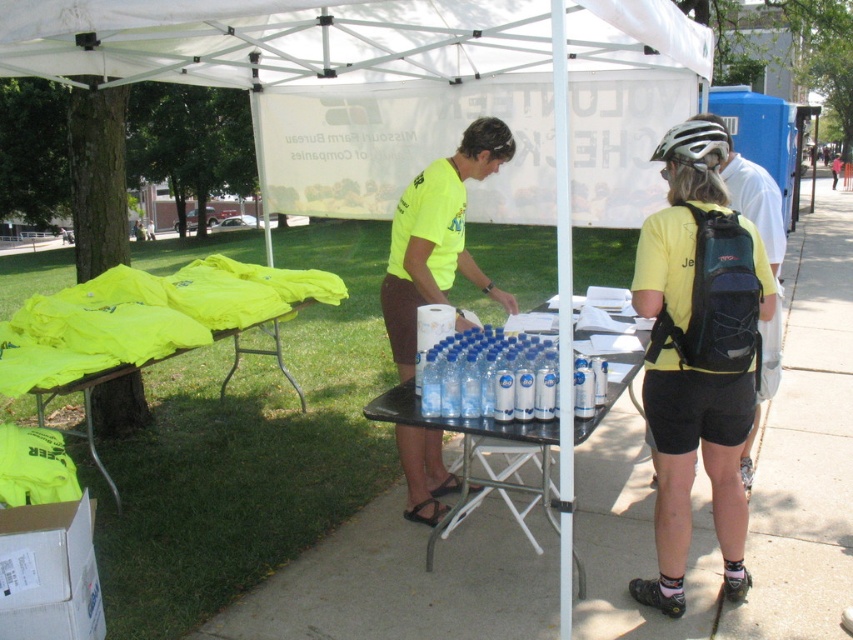
You are organizing an outdoor event and need to place a 6.5 feet long banner between the neon yellow fabric at left and the matte black backpack at right. Will there be enough space between them to fit the banner without bending it?

The distance between the neon yellow fabric at left and the matte black backpack at right is 8.25 feet. Since the banner is 6.5 feet long, there is sufficient space to place it straight between them without bending.

You are a runner participating in the Missouri Rail Trail Ultra Run and you are standing at the starting line, which is 10 feet away from the camera. You need to grab your race bib from the yellow matte shirt at center before the race starts. Can you reach it without moving closer?

The yellow matte shirt at center is 8.96 feet away from the camera. Since you are 10 feet away from the camera, you are 1.04 feet farther than the shirt, so you cannot reach it without moving closer.

In the scene shown: You are at an outdoor event and see a yellow matte shirt at center. Where exactly is it located in the image?

The yellow matte shirt at center is located at point coordinates of 0.553 on the x axis and 0.819 on the y axis.